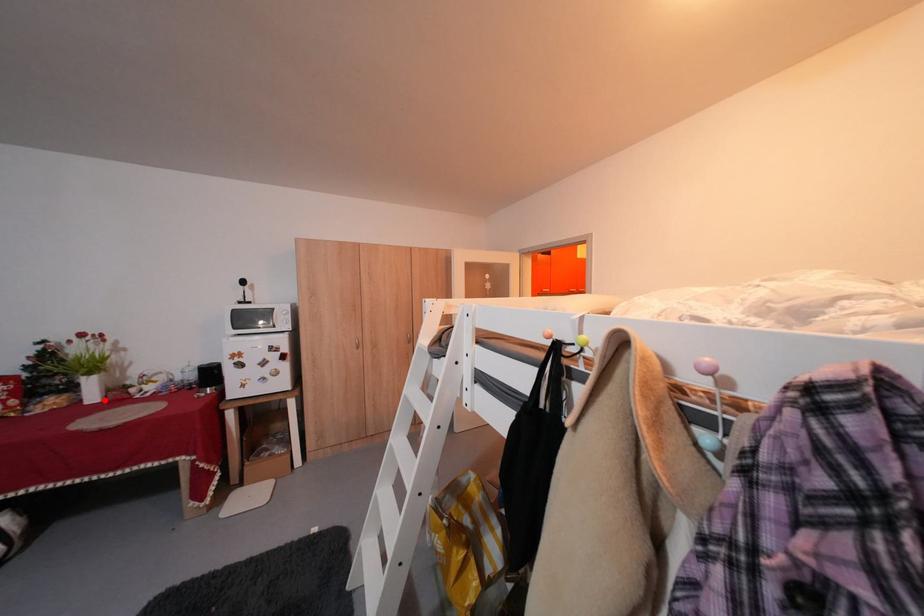
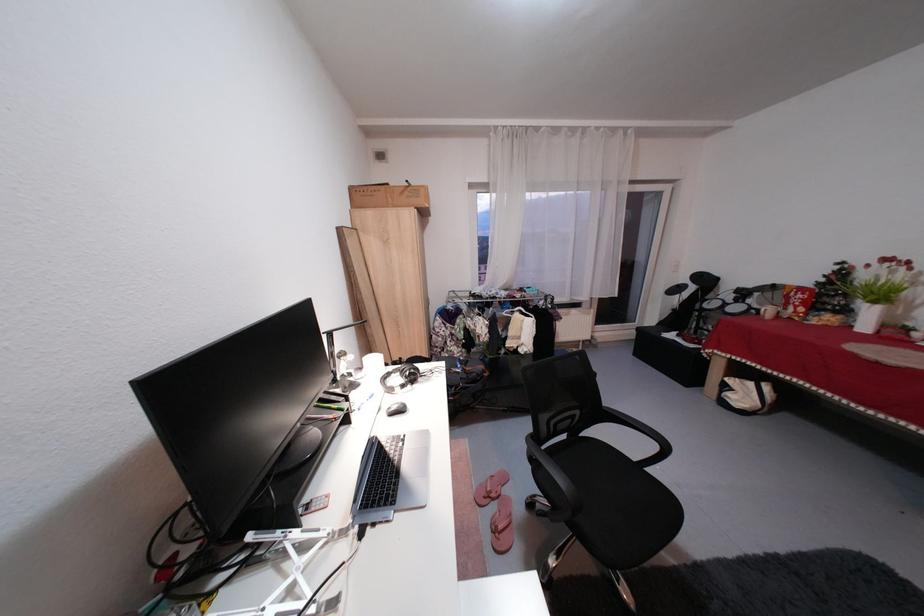
Question: A red point is marked in image1. In image2, is the corresponding 3D point closer to the camera or farther? Reply with the corresponding letter.

Choices:
 (A) The corresponding 3D point is closer.
 (B) The corresponding 3D point is farther.

Answer: (B)